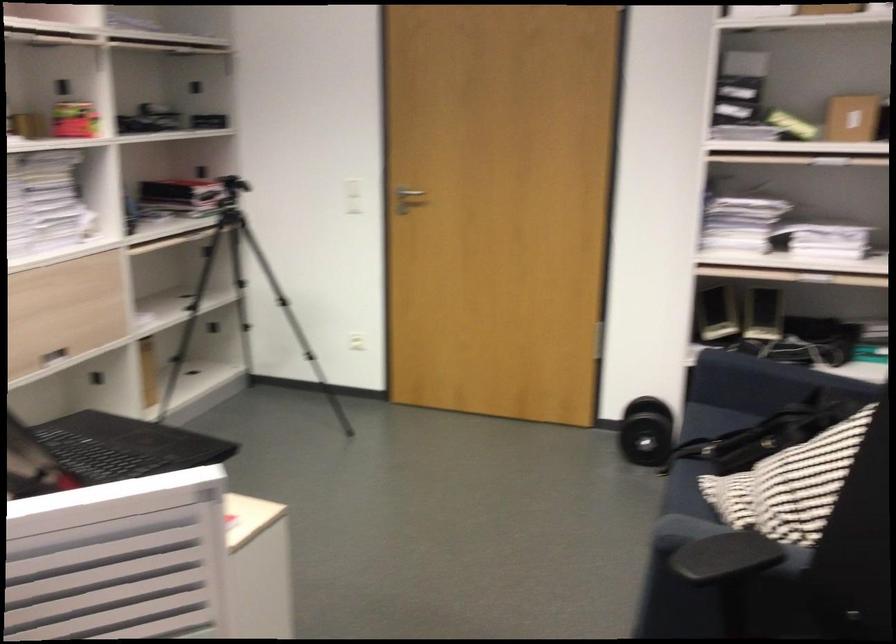
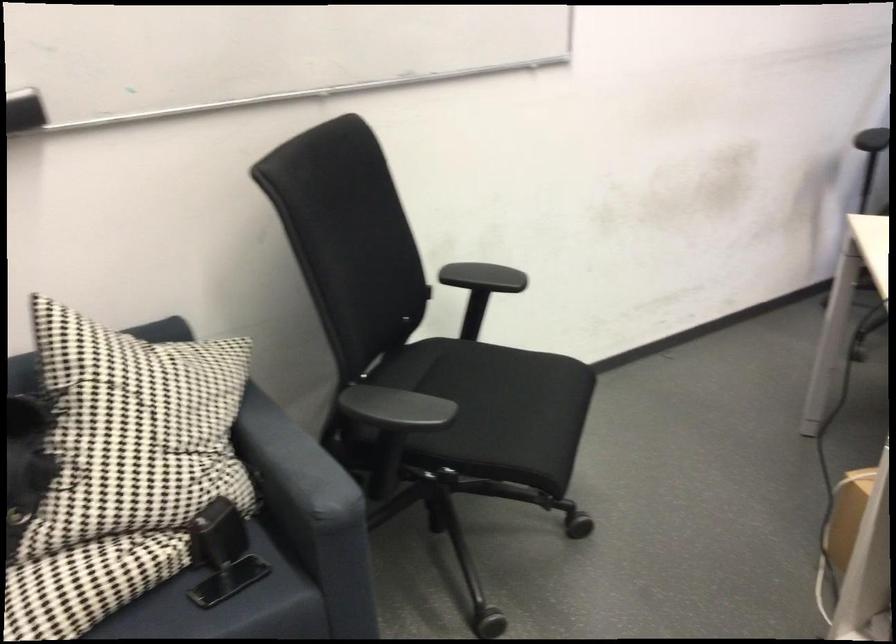
In the second image, find the point that corresponds to pixel 725 562 in the first image.

(395, 408)